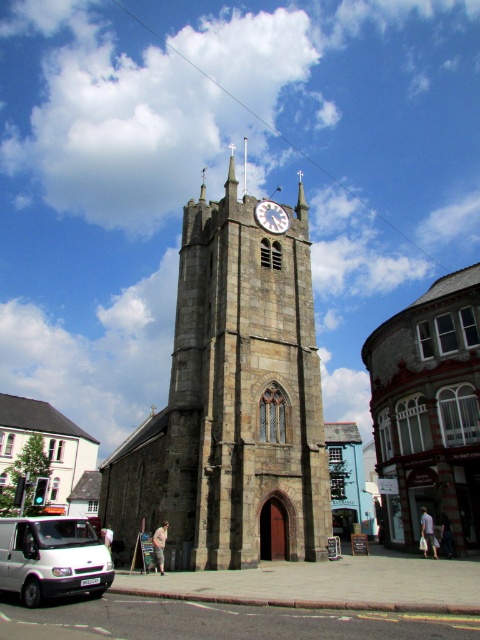
You are standing in the town square and want to take a photo of the stone church at center. If you are positioned at the coordinates where the town square starts, which direction should you face to capture the church in your frame?

Since the stone church at center is located at point [429,410], you should face towards the center of the town square to capture it in your photo.

You are a photographer planning to capture the stone church at center and the white matte van at lower left in a single frame. Based on their sizes, which object should you focus on to ensure both are clearly visible in the photo?

The stone church at center is bigger than the white matte van at lower left. To ensure both are clearly visible, focus on the stone church at center as it occupies more space in the frame, allowing the van to be captured in the background or side without overcrowding the composition.

You are standing in the town square looking at the church tower. There are two points marked on the tower. Which point is closer to you, point (244, 497) or point (271, 220)?

Point (244, 497) is closer to the viewer than point (271, 220).